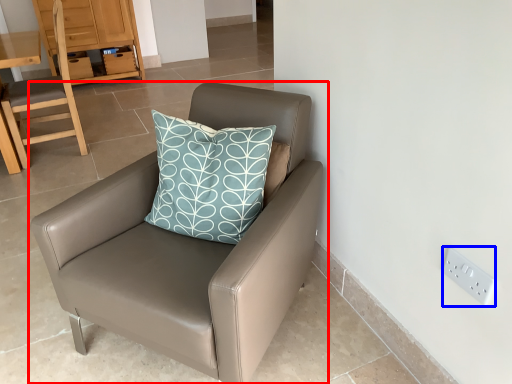
Question: Which object is further to the camera taking this photo, chair (highlighted by a red box) or electric outlet (highlighted by a blue box)?

Choices:
 (A) chair
 (B) electric outlet

Answer: (B)